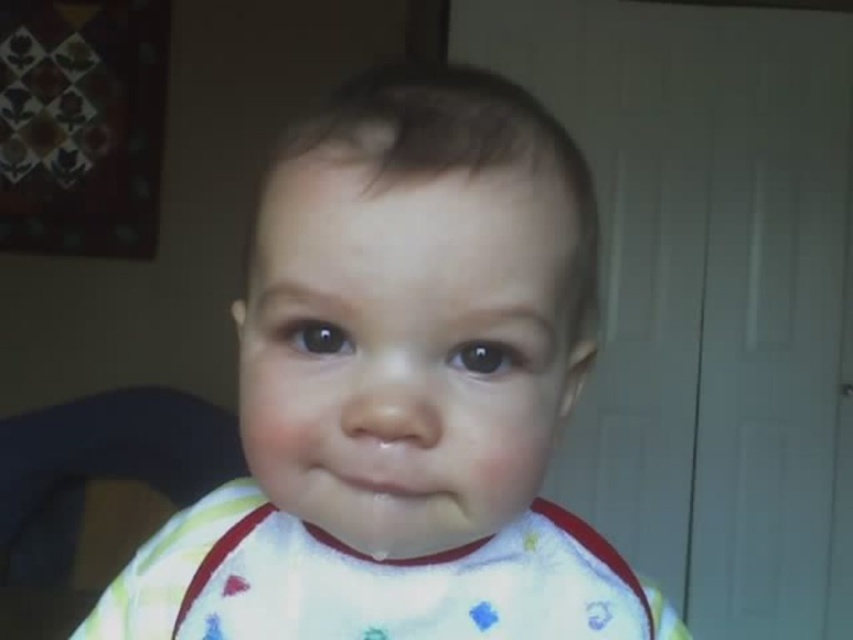
Question: In this image, where is white soft bib at center located relative to dark gray fabric feeding chair at left?

Choices:
 (A) right
 (B) left

Answer: (A)

Question: Is white fabric bib at center further to the viewer compared to dark gray fabric feeding chair at left?

Choices:
 (A) no
 (B) yes

Answer: (A)

Question: Which of the following is the closest to the observer?

Choices:
 (A) white soft bib at center
 (B) white fabric bib at center

Answer: (A)

Question: Which object is closer to the camera taking this photo?

Choices:
 (A) dark gray fabric feeding chair at left
 (B) white fabric bib at center

Answer: (B)

Question: Among these points, which one is nearest to the camera?

Choices:
 (A) (18, 636)
 (B) (437, 636)

Answer: (B)

Question: Is white soft bib at center thinner than dark gray fabric feeding chair at left?

Choices:
 (A) no
 (B) yes

Answer: (B)